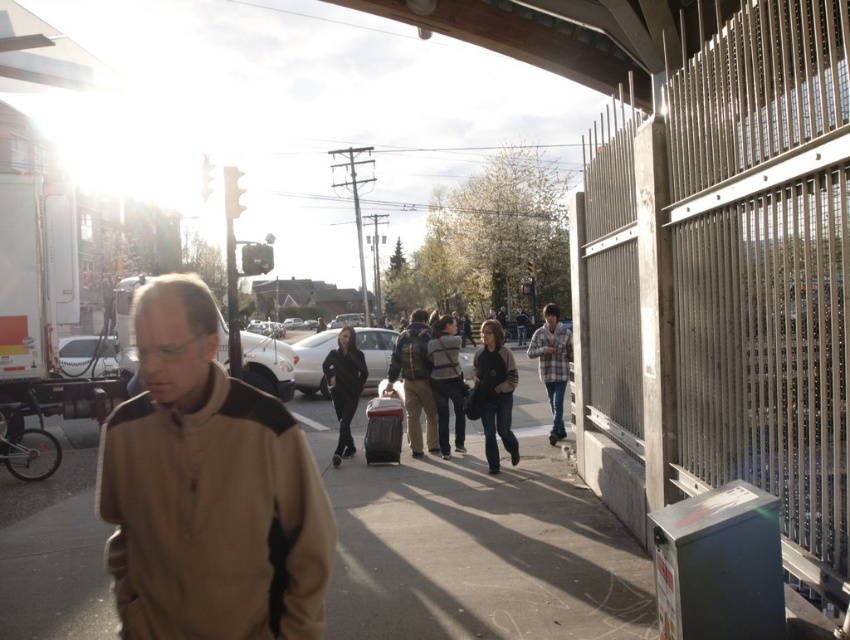
Question: Can you confirm if black matte jacket at center is bigger than plaid fabric shirt at center-right?

Choices:
 (A) yes
 (B) no

Answer: (B)

Question: Which of the following is the closest to the observer?

Choices:
 (A) (330, 385)
 (B) (541, 358)
 (C) (416, 445)

Answer: (A)

Question: Among these points, which one is farthest from the camera?

Choices:
 (A) click(514, 458)
 (B) click(357, 378)
 (C) click(429, 346)

Answer: (B)

Question: Considering the relative positions of dark brown leather jacket at center and dark gray backpack at center in the image provided, where is dark brown leather jacket at center located with respect to dark gray backpack at center?

Choices:
 (A) left
 (B) right

Answer: (B)

Question: Which point is closer to the camera taking this photo?

Choices:
 (A) (163, 550)
 (B) (418, 406)
 (C) (326, 356)

Answer: (A)

Question: From the image, what is the correct spatial relationship of matte black backpack at center in relation to dark gray backpack at center?

Choices:
 (A) above
 (B) below

Answer: (A)